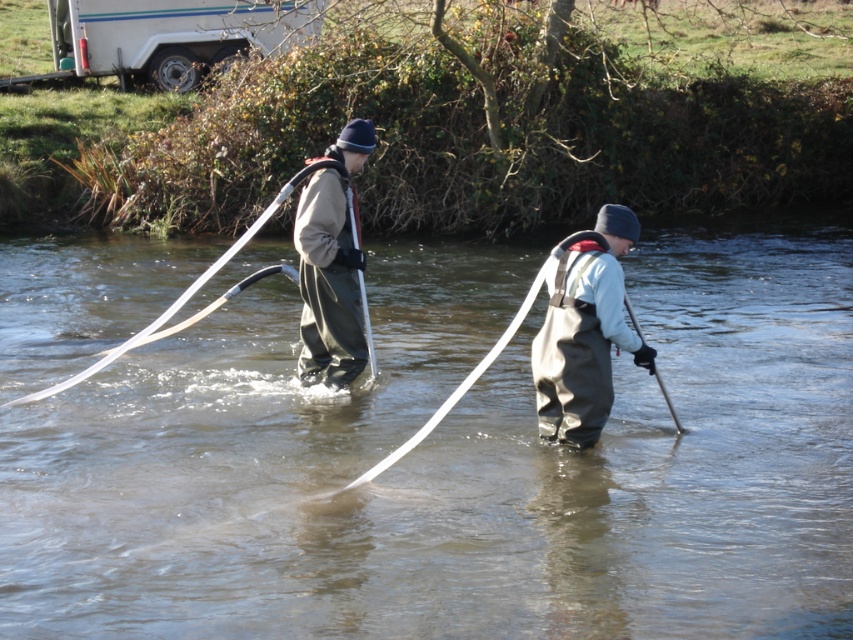
You are a safety inspector assessing the scene. You notice the brown rubber boots at center and the matte gray waders at center. According to safety protocols, the boots should be positioned above the waders to prevent water from entering. Is the current arrangement compliant with safety standards?

The brown rubber boots at center is below matte gray waders at center, which violates safety protocols. The boots should be positioned above the waders to prevent water from entering.

You are a safety inspector checking the equipment of two workers in the river. You notice the gray rubber waders at center and the matte gray waders at center. Which one is positioned lower in the water?

The gray rubber waders at center is positioned lower in the water than the matte gray waders at center, as it is described to be below it.